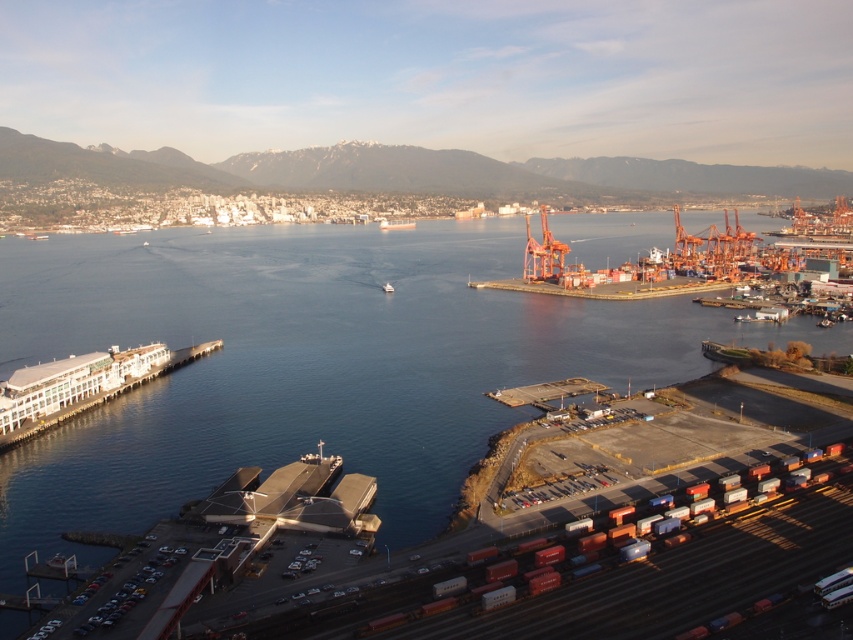
You are a sailor trying to navigate a narrow channel between two objects in the port. You see the blue water at center and the white plastic boat at center. Which object should you steer your boat towards to stay in the channel?

You should steer towards the white plastic boat at center because the blue water at center is positioned on its left side, indicating the channel is to the right of the boat.

You are a drone operator tasked with capturing aerial footage of the port. Your drone has a maximum flight range of 100 meters. If you are positioned at the camera location, can your drone reach the blue water at center without exceeding its range?

The distance of blue water at center from camera is 97.99 meters, so yes, the drone can reach the blue water at center as it is within the 100 meters range.

You are a sailor who needs to navigate a small white plastic boat at center through the blue water at center. Can you safely move the boat through the water?

The blue water at center is above the white plastic boat at center, meaning the boat is submerged in the water. Therefore, the sailor can safely move the white plastic boat at center through the blue water at center as it is already floating within it.